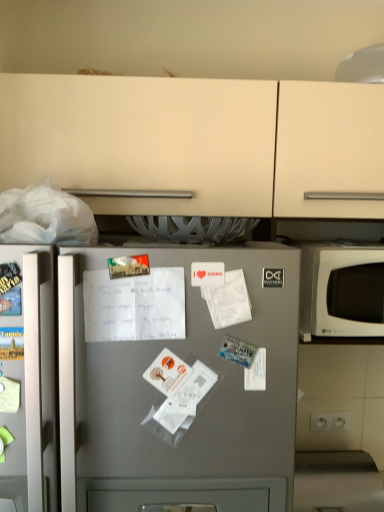
Question: Can you confirm if white matte microwave at right is shorter than white paper receipt at center?

Choices:
 (A) no
 (B) yes

Answer: (A)

Question: Is the depth of white matte microwave at right greater than that of white paper receipt at center?

Choices:
 (A) yes
 (B) no

Answer: (A)

Question: Is white matte microwave at right far away from white paper receipt at center?

Choices:
 (A) yes
 (B) no

Answer: (B)

Question: From the image's perspective, is white matte microwave at right below white paper receipt at center?

Choices:
 (A) yes
 (B) no

Answer: (B)

Question: Is white matte microwave at right outside white paper receipt at center?

Choices:
 (A) yes
 (B) no

Answer: (A)

Question: From the image's perspective, is white matte microwave at right located above white paper receipt at center?

Choices:
 (A) no
 (B) yes

Answer: (B)

Question: Does white paper receipt at center have a smaller size compared to satin silver fridge at center?

Choices:
 (A) yes
 (B) no

Answer: (A)

Question: From the image's perspective, would you say white paper receipt at center is shown under satin silver fridge at center?

Choices:
 (A) yes
 (B) no

Answer: (B)

Question: Is satin silver fridge at center completely or partially inside white paper receipt at center?

Choices:
 (A) yes
 (B) no

Answer: (B)

Question: Would you consider white paper receipt at center to be distant from satin silver fridge at center?

Choices:
 (A) no
 (B) yes

Answer: (A)

Question: Is white paper receipt at center positioned with its back to satin silver fridge at center?

Choices:
 (A) no
 (B) yes

Answer: (B)

Question: Can you confirm if white paper receipt at center is wider than satin silver fridge at center?

Choices:
 (A) no
 (B) yes

Answer: (A)

Question: From the image's perspective, is white matte microwave at right located beneath satin silver fridge at center?

Choices:
 (A) yes
 (B) no

Answer: (B)